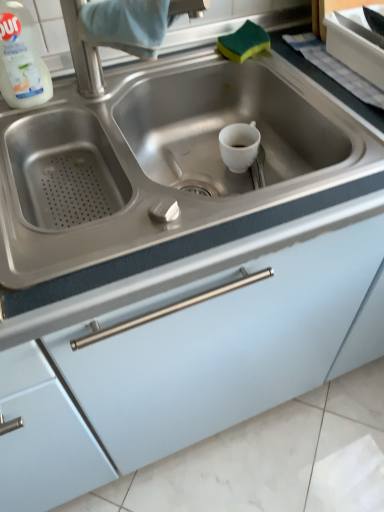
Locate an element on the screen. The height and width of the screenshot is (512, 384). matte white cabinet at center is located at coordinates (193, 356).

The image size is (384, 512). I want to click on white plastic bottle at upper left, so click(x=21, y=59).

Is the position of stainless steel sink at center more distant than that of white plastic bottle at upper left?

No.

Is stainless steel sink at center located outside white plastic bottle at upper left?

Yes, stainless steel sink at center is located beyond the bounds of white plastic bottle at upper left.

Is stainless steel sink at center facing away from white plastic bottle at upper left?

That's not correct — stainless steel sink at center is not looking away from white plastic bottle at upper left.

How different are the orientations of stainless steel sink at center and white plastic bottle at upper left in degrees?

The angle between the facing direction of stainless steel sink at center and the facing direction of white plastic bottle at upper left is 1.63 degrees.

Is stainless steel sink at center aimed at matte white cabinet at center?

Yes, stainless steel sink at center is facing matte white cabinet at center.

Can you tell me how much stainless steel sink at center and matte white cabinet at center differ in facing direction?

0.834 degrees.

From the image's perspective, which one is positioned lower, stainless steel sink at center or matte white cabinet at center?

matte white cabinet at center is shown below in the image.

I want to click on sink above the matte white cabinet at center (from a real-world perspective), so [157, 160].

Looking at this image, is white plastic bottle at upper left positioned beyond the bounds of stainless steel faucet at upper center?

Absolutely, white plastic bottle at upper left is external to stainless steel faucet at upper center.

Is white plastic bottle at upper left positioned with its back to stainless steel faucet at upper center?

No.

Relative to stainless steel faucet at upper center, is white plastic bottle at upper left in front or behind?

white plastic bottle at upper left is behind stainless steel faucet at upper center.

You are a GUI agent. You are given a task and a screenshot of the screen. Output one action in this format:
    pyautogui.click(x=<x>, y=<y>)
    Task: Click on the sink to the right of white plastic bottle at upper left
    
    Given the screenshot: What is the action you would take?
    pyautogui.click(x=157, y=160)

Between white plastic bottle at upper left and stainless steel sink at center, which one has smaller size?

Smaller between the two is white plastic bottle at upper left.

Considering the sizes of objects white plastic bottle at upper left and stainless steel sink at center in the image provided, who is shorter, white plastic bottle at upper left or stainless steel sink at center?

white plastic bottle at upper left is shorter.

Is stainless steel faucet at upper center thinner than stainless steel sink at center?

Correct, the width of stainless steel faucet at upper center is less than that of stainless steel sink at center.

Consider the image. From a real-world perspective, is stainless steel faucet at upper center located beneath stainless steel sink at center?

No, from a real-world perspective, stainless steel faucet at upper center is not below stainless steel sink at center.

Is stainless steel faucet at upper center touching stainless steel sink at center?

No, stainless steel faucet at upper center is not beside stainless steel sink at center.

Is white plastic bottle at upper left a part of stainless steel faucet at upper center?

That's incorrect, white plastic bottle at upper left is not inside stainless steel faucet at upper center.

Considering the points (130, 53) and (0, 48), which point is in front, point (130, 53) or point (0, 48)?

The point (0, 48) is closer to the camera.

Measure the distance between stainless steel faucet at upper center and white plastic bottle at upper left.

stainless steel faucet at upper center is 4.49 inches away from white plastic bottle at upper left.

Is stainless steel faucet at upper center positioned with its back to white plastic bottle at upper left?

No, stainless steel faucet at upper center is not facing the opposite direction of white plastic bottle at upper left.

Is matte white cabinet at center next to stainless steel faucet at upper center and touching it?

No, matte white cabinet at center is not with stainless steel faucet at upper center.

From a real-world perspective, is matte white cabinet at center located beneath stainless steel faucet at upper center?

Yes, from a real-world perspective, matte white cabinet at center is under stainless steel faucet at upper center.

Is point (150, 411) positioned before point (101, 75)?

No, (150, 411) is further to viewer.

From the image's perspective, which object appears higher, matte white cabinet at center or stainless steel faucet at upper center?

stainless steel faucet at upper center appears higher in the image.

In the image, there is a stainless steel sink at center. Identify the location of cleaning product above it (from the image's perspective). (21, 59).

This screenshot has height=512, width=384. I want to click on cabinetry in front of the stainless steel sink at center, so click(193, 356).

Estimate the real-world distances between objects in this image. Which object is further from matte white cabinet at center, stainless steel sink at center or stainless steel faucet at upper center?

The object further to matte white cabinet at center is stainless steel faucet at upper center.

Estimate the real-world distances between objects in this image. Which object is further from stainless steel sink at center, matte white cabinet at center or white plastic bottle at upper left?

matte white cabinet at center is positioned further to the anchor stainless steel sink at center.

From the image, which object appears to be nearer to matte white cabinet at center, white plastic bottle at upper left or stainless steel sink at center?

stainless steel sink at center lies closer to matte white cabinet at center than the other object.

Looking at the image, which one is located further to stainless steel faucet at upper center, white plastic bottle at upper left or matte white cabinet at center?

Based on the image, matte white cabinet at center appears to be further to stainless steel faucet at upper center.

Considering their positions, is white plastic bottle at upper left positioned closer to stainless steel faucet at upper center than stainless steel sink at center?

white plastic bottle at upper left is closer to stainless steel faucet at upper center.

Considering their positions, is stainless steel faucet at upper center positioned closer to white plastic bottle at upper left than matte white cabinet at center?

stainless steel faucet at upper center is closer to white plastic bottle at upper left.

Which object lies further to the anchor point stainless steel faucet at upper center, stainless steel sink at center or white plastic bottle at upper left?

Among the two, stainless steel sink at center is located further to stainless steel faucet at upper center.

When comparing their distances from matte white cabinet at center, does stainless steel faucet at upper center or white plastic bottle at upper left seem further?

white plastic bottle at upper left is further to matte white cabinet at center.

Locate an element on the screen. This screenshot has width=384, height=512. sink between stainless steel faucet at upper center and matte white cabinet at center from top to bottom is located at coordinates (157, 160).

Identify the location of cleaning product between stainless steel faucet at upper center and matte white cabinet at center in the up-down direction. Image resolution: width=384 pixels, height=512 pixels. (21, 59).

Find the location of a particular element. The height and width of the screenshot is (512, 384). faucet located between white plastic bottle at upper left and stainless steel sink at center in the left-right direction is located at coordinates (88, 50).

You are a GUI agent. You are given a task and a screenshot of the screen. Output one action in this format:
    pyautogui.click(x=<x>, y=<y>)
    Task: Click on the sink between white plastic bottle at upper left and matte white cabinet at center from left to right
    This screenshot has height=512, width=384.
    Given the screenshot: What is the action you would take?
    pyautogui.click(x=157, y=160)